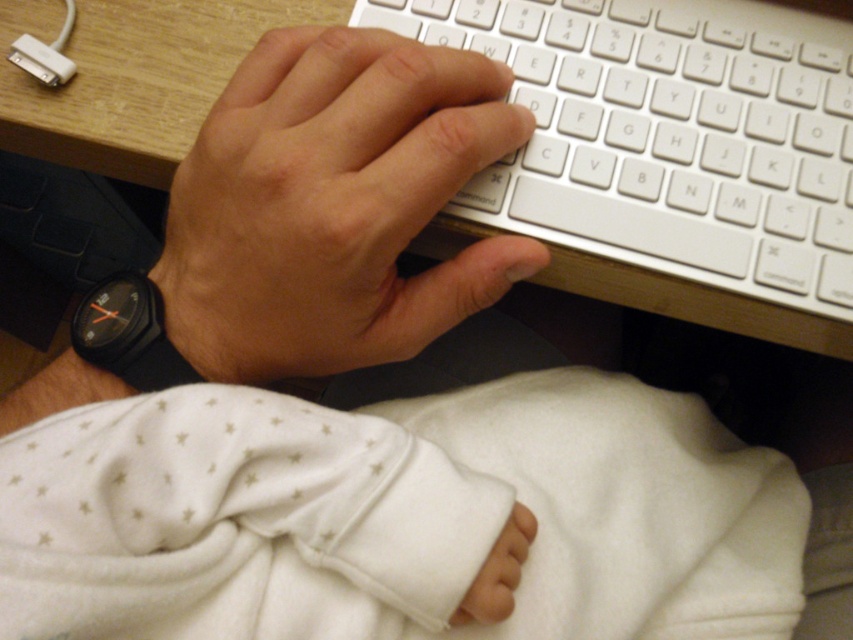
You are a virtual assistant trying to determine the location of the hand in the image. The hand is at the center, and there is a point marked at coordinates point (334, 205). Can you confirm if the point is on the hand?

The point (334, 205) corresponds to smooth skin hand at center, so yes, the point is on the hand.

You are a designer creating a model for a virtual reality simulation. You need to ensure that the hand model can fit comfortably within the space designated for the wooden desk surface. Based on the scene, does the smooth skin hand at center have a smaller size compared to the wooden at upper center?

Yes, the smooth skin hand at center has a smaller size compared to the wooden at upper center, so it can fit comfortably within the designated space.